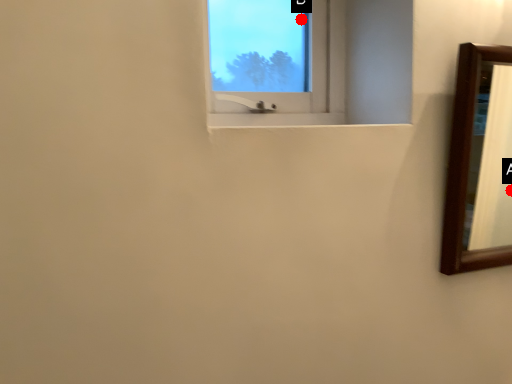
Question: Two points are circled on the image, labeled by A and B beside each circle. Which point is closer to the camera?

Choices:
 (A) A is closer
 (B) B is closer

Answer: (B)